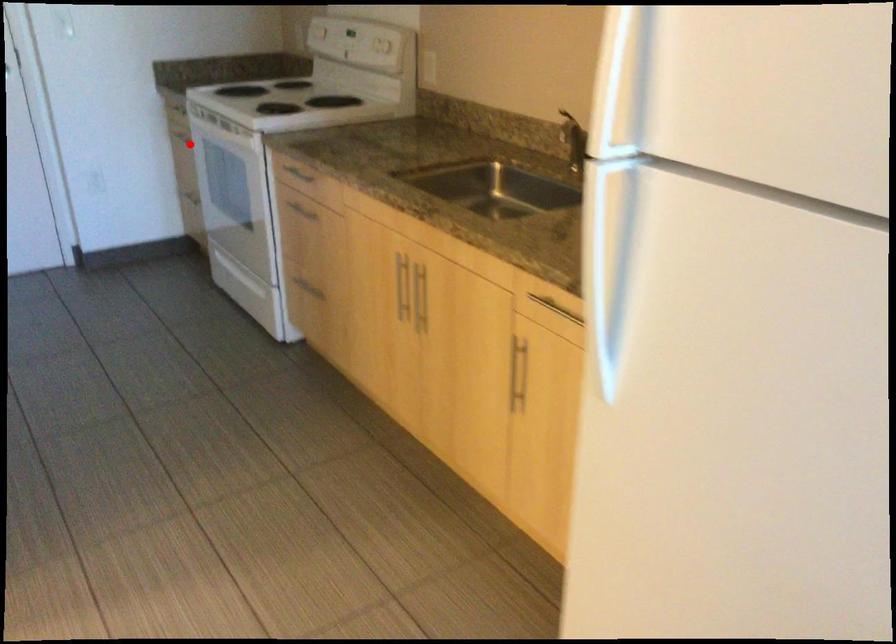
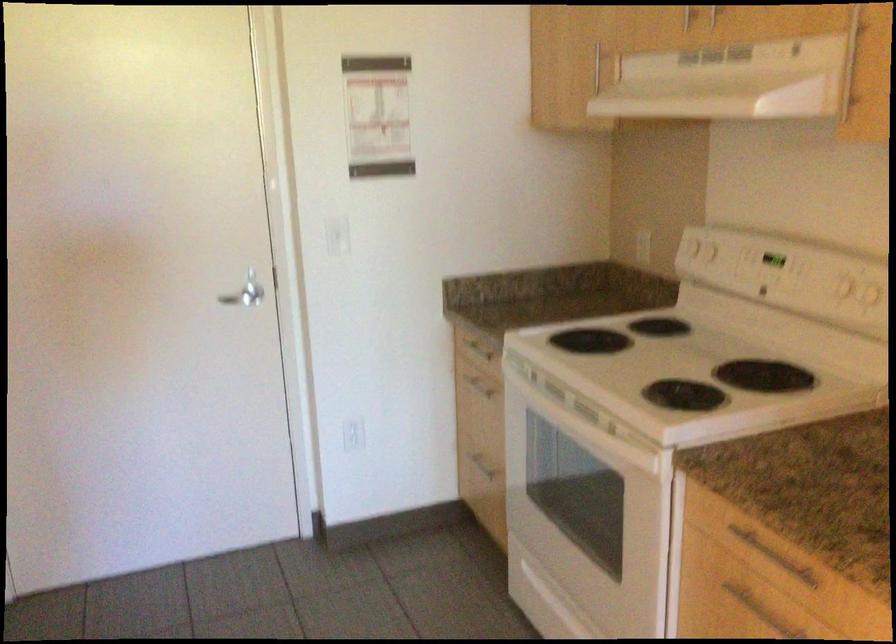
Question: I am providing you with two images of the same scene from different viewpoints. Image1 has a red point marked. In image2, the corresponding 3D location appears at what relative position? Reply with the corresponding letter.

Choices:
 (A) Closer
 (B) Farther

Answer: (A)